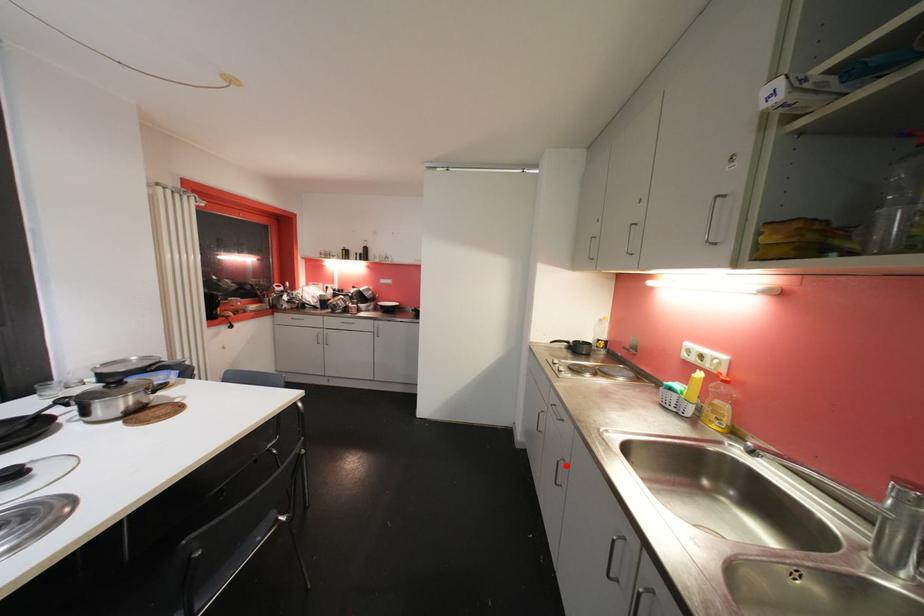
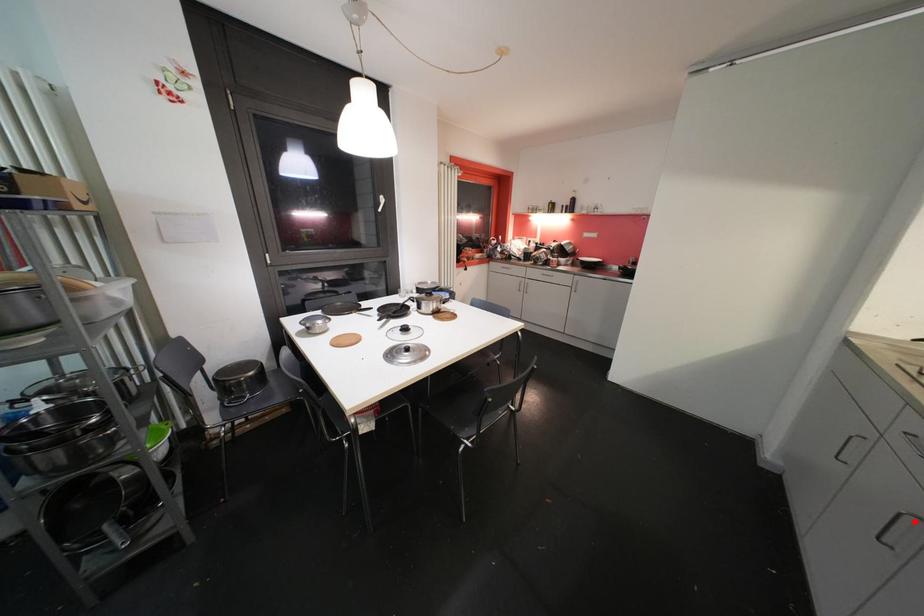
I am providing you with two images of the same scene from different viewpoints. A red point is marked on the first image and another point is marked on the second image. Are the points marked in image1 and image2 representing the same 3D position?

Yes